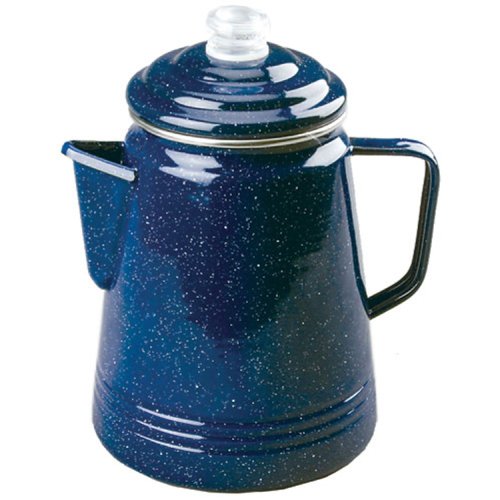
You are a GUI agent. You are given a task and a screenshot of the screen. Output one action in this format:
    pyautogui.click(x=<x>, y=<y>)
    Task: Click on the lid handle
    
    Given the screenshot: What is the action you would take?
    pyautogui.click(x=240, y=37)